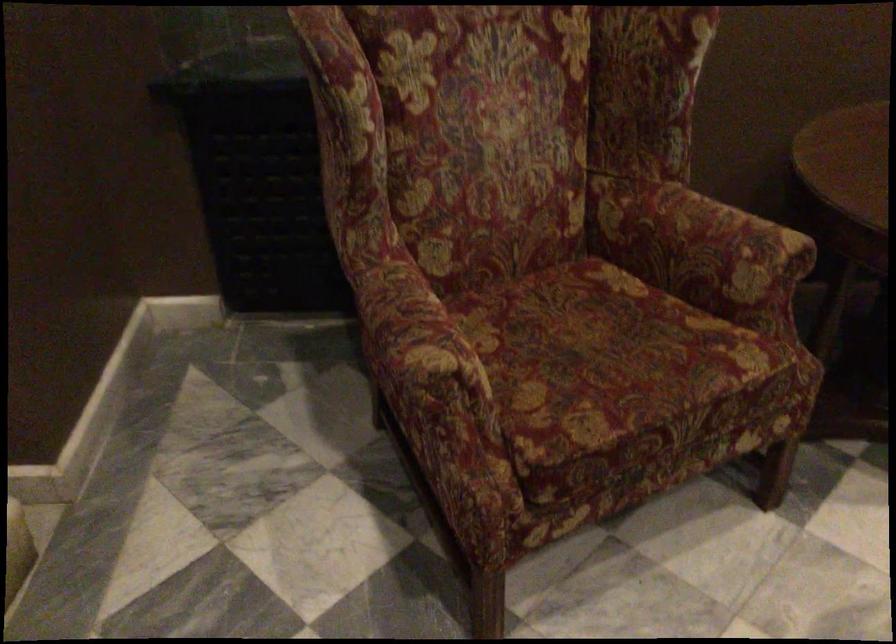
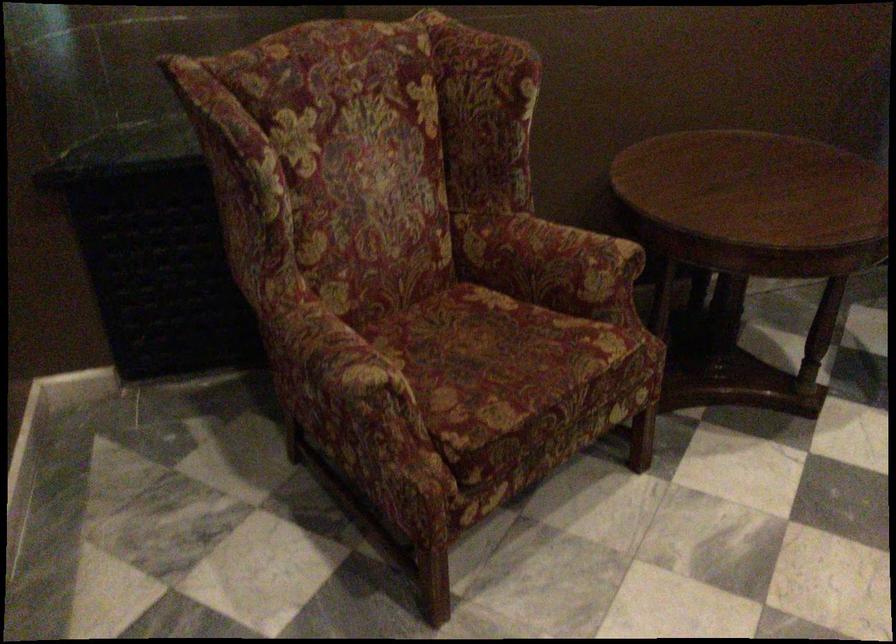
Locate, in the second image, the point that corresponds to [599,363] in the first image.

(495, 363)